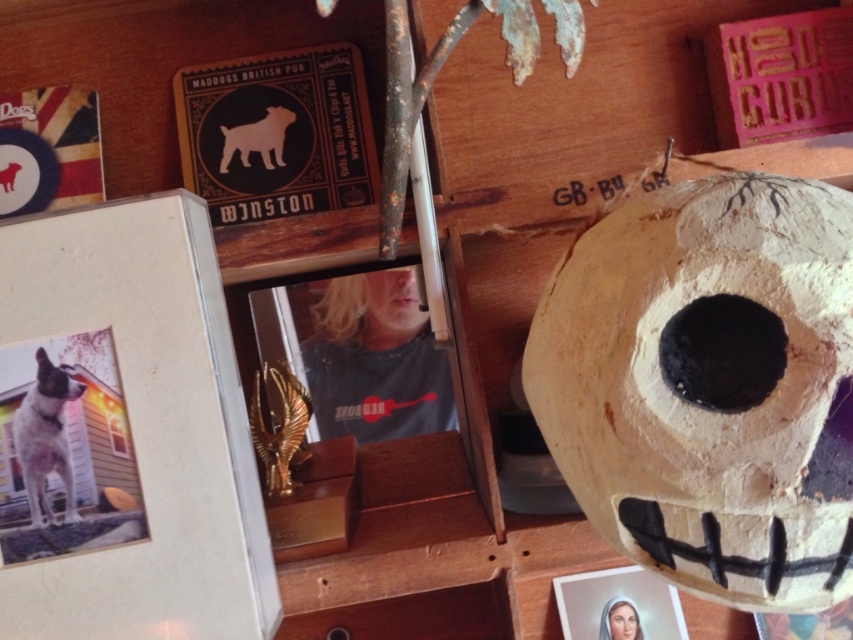
You are an interior designer trying to rearrange the items on the wooden shelves. The matte black dog at upper left and the smooth skin portrait at lower right are two items you want to move closer together. Currently, how far apart are these two items in inches?

The matte black dog at upper left is 24.48 inches away from the smooth skin portrait at lower right.

You are organizing a clothing donation drive and need to determine if the gray fabric shirt at center can be folded and placed on top of the smooth skin portrait at lower right without covering it entirely. Based on their sizes, is this possible?

The gray fabric shirt at center is larger than the smooth skin portrait at lower right, so folding it might still result in partial coverage. However, if folded carefully to reduce its dimensions, it could potentially fit without covering the entire portrait.

You are an interior designer arranging items on a shelf. You have a matte black dog at upper left and a smooth skin portrait at lower right. Which item is positioned higher on the shelf?

The matte black dog at upper left is positioned higher on the shelf than the smooth skin portrait at lower right.